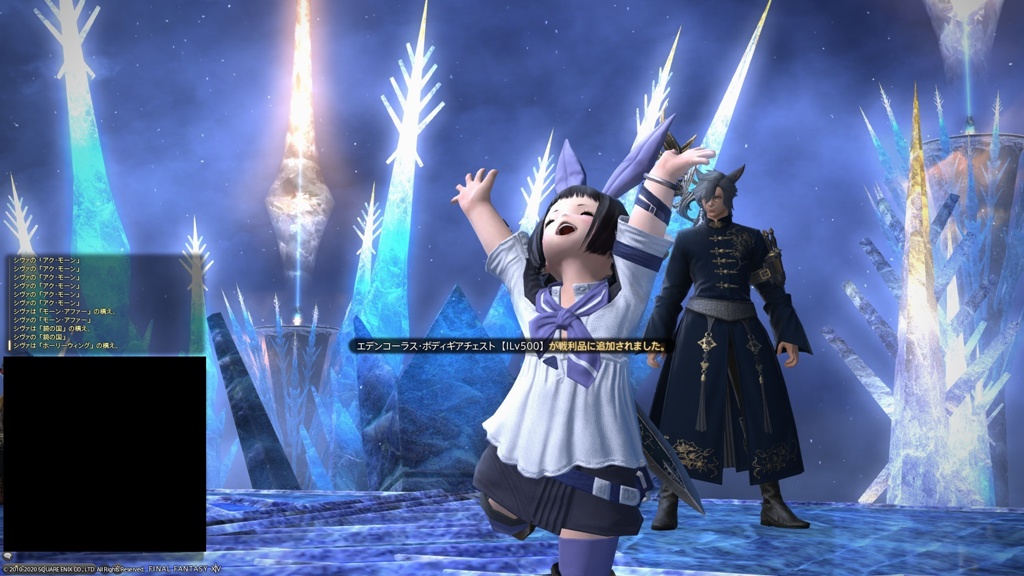
What are the coordinates of `coat` in the screenshot? It's located at (706, 276).